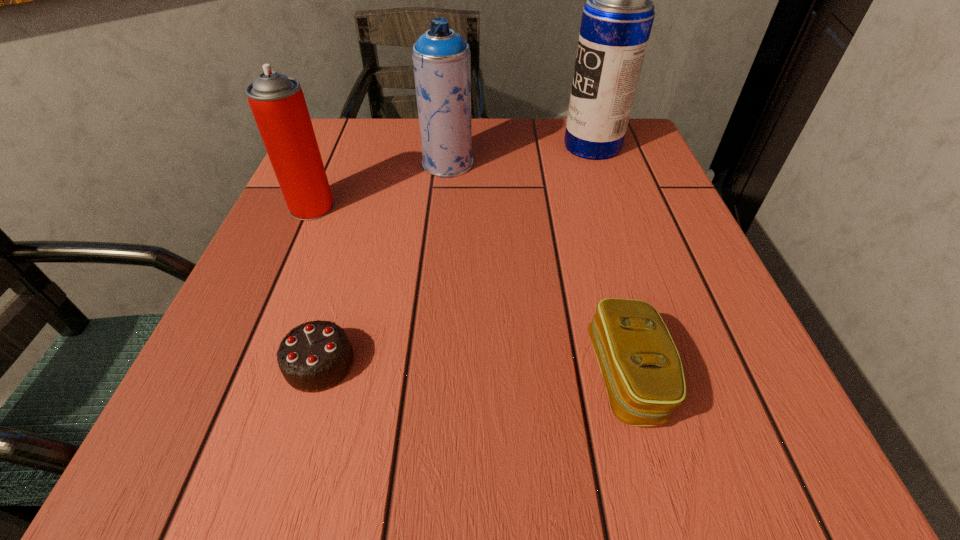
The height and width of the screenshot is (540, 960). Find the location of `vacant space located on the label side of the rightmost aerosol can`. vacant space located on the label side of the rightmost aerosol can is located at coordinates (403, 146).

Find the location of a particular element. The height and width of the screenshot is (540, 960). vacant space located 0.050m on the back of the third object from left to right is located at coordinates (450, 139).

The width and height of the screenshot is (960, 540). What are the coordinates of `free space located 0.160m on the right of the nearest aerosol can` in the screenshot? It's located at (417, 207).

Identify the location of vacant space located 0.070m on the zipper side of the clutch bag. (540, 376).

Locate an element on the screen. This screenshot has height=540, width=960. free space located 0.260m on the zipper side of the clutch bag is located at coordinates (400, 376).

Find the location of a particular element. vacant space situated 0.250m on the zipper side of the clutch bag is located at coordinates (408, 376).

In order to click on vacant space located on the right of the chocolate cake in this screenshot , I will do `click(642, 363)`.

Image resolution: width=960 pixels, height=540 pixels. What are the coordinates of `object that is at the near edge` in the screenshot? It's located at (640, 365).

Identify the location of aerosol can that is at the left edge. (277, 102).

Where is `chocolate cake positioned at the left edge`? Image resolution: width=960 pixels, height=540 pixels. chocolate cake positioned at the left edge is located at coordinates point(315,356).